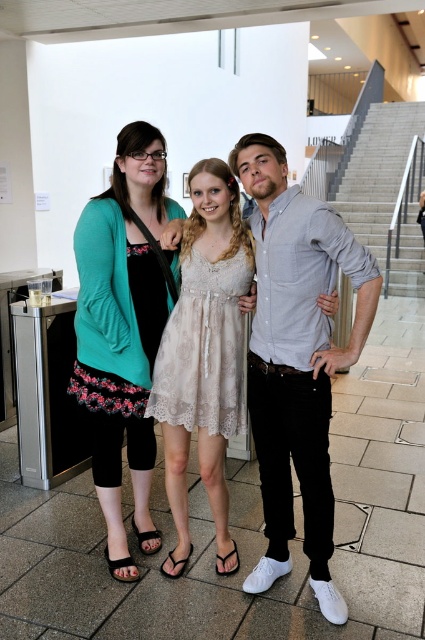
Question: Which point is farther from the camera taking this photo?

Choices:
 (A) (363, 125)
 (B) (91, 352)

Answer: (A)

Question: Is light beige lace dress at center to the left of lace fabric dress at center from the viewer's perspective?

Choices:
 (A) no
 (B) yes

Answer: (A)

Question: Based on their relative distances, which object is nearer to the gray concrete stairs at upper center?

Choices:
 (A) light gray cotton shirt at center
 (B) light beige lace dress at center
 (C) teal fabric cardigan at center
 (D) lace fabric dress at center

Answer: (A)

Question: Which point is farther to the camera?

Choices:
 (A) lace fabric dress at center
 (B) teal fabric cardigan at center
 (C) light gray cotton shirt at center
 (D) gray concrete stairs at upper center

Answer: (D)

Question: From the image, what is the correct spatial relationship of light gray cotton shirt at center in relation to teal fabric cardigan at center?

Choices:
 (A) below
 (B) above

Answer: (A)

Question: Considering the relative positions of lace fabric dress at center and gray concrete stairs at upper center in the image provided, where is lace fabric dress at center located with respect to gray concrete stairs at upper center?

Choices:
 (A) left
 (B) right

Answer: (A)